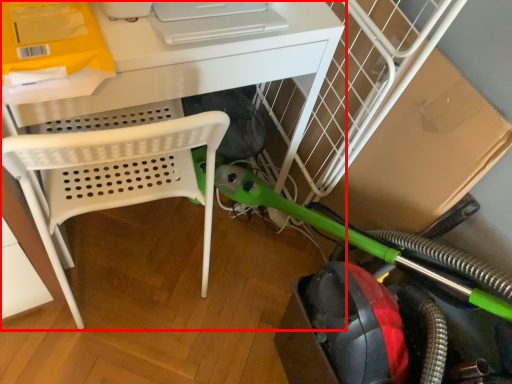
Question: Where is desk (annotated by the red box) located in relation to garden hose in the image?

Choices:
 (A) right
 (B) left

Answer: (B)